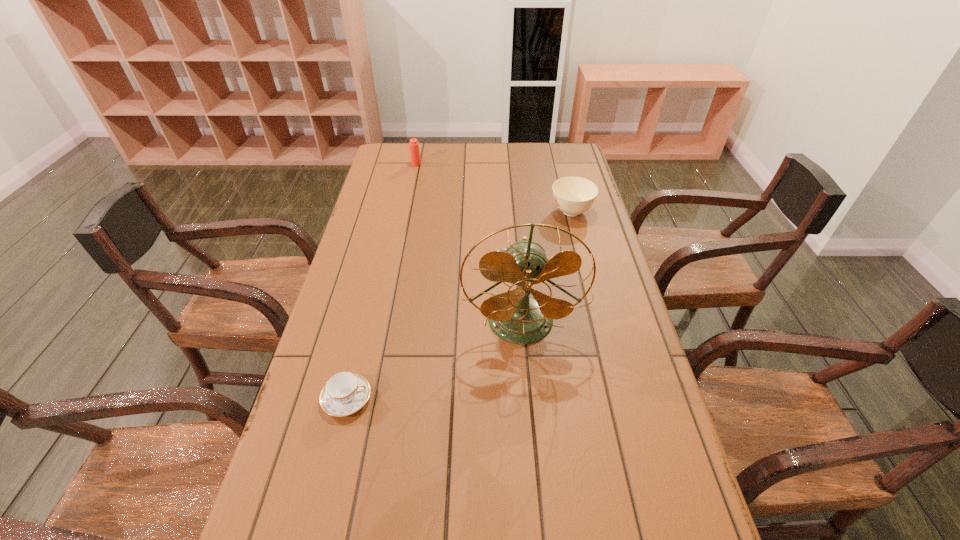
Image resolution: width=960 pixels, height=540 pixels. Find the location of `vacant area situated on the back of the sugar bowl`. vacant area situated on the back of the sugar bowl is located at coordinates (556, 148).

Where is `vacant space situated 0.360m on the side with the handle of the teacup`? The height and width of the screenshot is (540, 960). vacant space situated 0.360m on the side with the handle of the teacup is located at coordinates (532, 399).

Find the location of a particular element. object that is positioned at the far edge is located at coordinates (413, 144).

This screenshot has height=540, width=960. Identify the location of Tabasco sauce present at the left edge. (413, 144).

Find the location of a particular element. This screenshot has height=540, width=960. teacup situated at the left edge is located at coordinates (345, 393).

Where is `fan at the right edge`? The height and width of the screenshot is (540, 960). fan at the right edge is located at coordinates (514, 316).

Where is `sugar bowl located in the right edge section of the desktop`? The width and height of the screenshot is (960, 540). sugar bowl located in the right edge section of the desktop is located at coordinates (572, 195).

Identify the location of object situated at the far left corner. Image resolution: width=960 pixels, height=540 pixels. (413, 144).

This screenshot has height=540, width=960. Identify the location of free space at the far edge of the desktop. 497,171.

The height and width of the screenshot is (540, 960). Identify the location of vacant space at the left edge of the desktop. (312, 366).